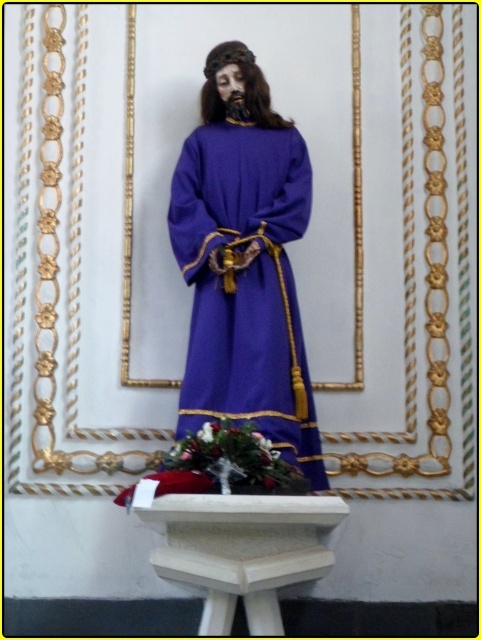
You are an art restorer examining the statue. You notice the purple woolen robe at center and the white wood altar at center. Which object is covering the other?

The purple woolen robe at center is positioned over the white wood altar at center, meaning the robe is covering the altar.